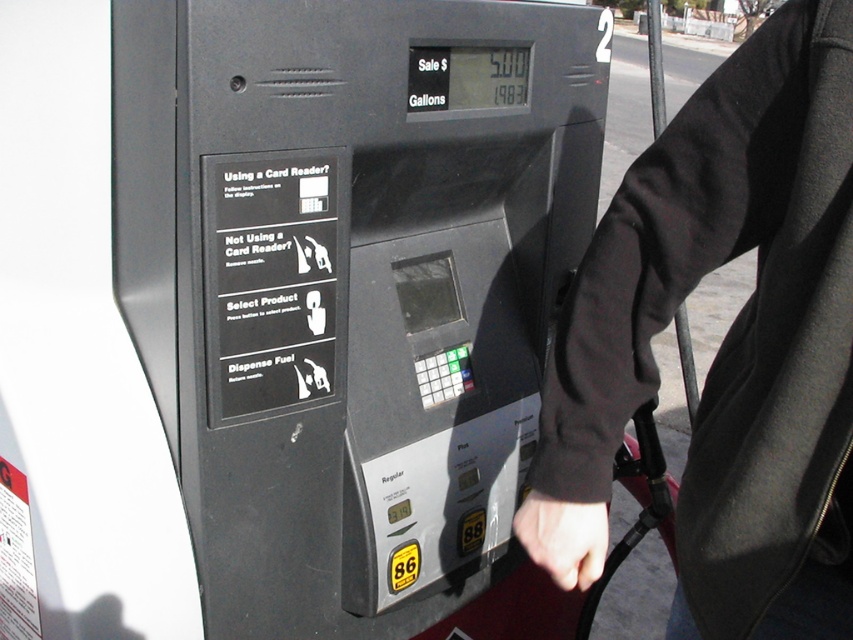
Question: Among these points, which one is nearest to the camera?

Choices:
 (A) (287, 97)
 (B) (606, 269)

Answer: (B)

Question: Is black plastic gas pump at center to the left of black fabric sleeve at upper right from the viewer's perspective?

Choices:
 (A) yes
 (B) no

Answer: (A)

Question: Can you confirm if black plastic gas pump at center is positioned to the left of black fabric sleeve at upper right?

Choices:
 (A) no
 (B) yes

Answer: (B)

Question: Is black plastic gas pump at center wider than black fabric sleeve at upper right?

Choices:
 (A) yes
 (B) no

Answer: (A)